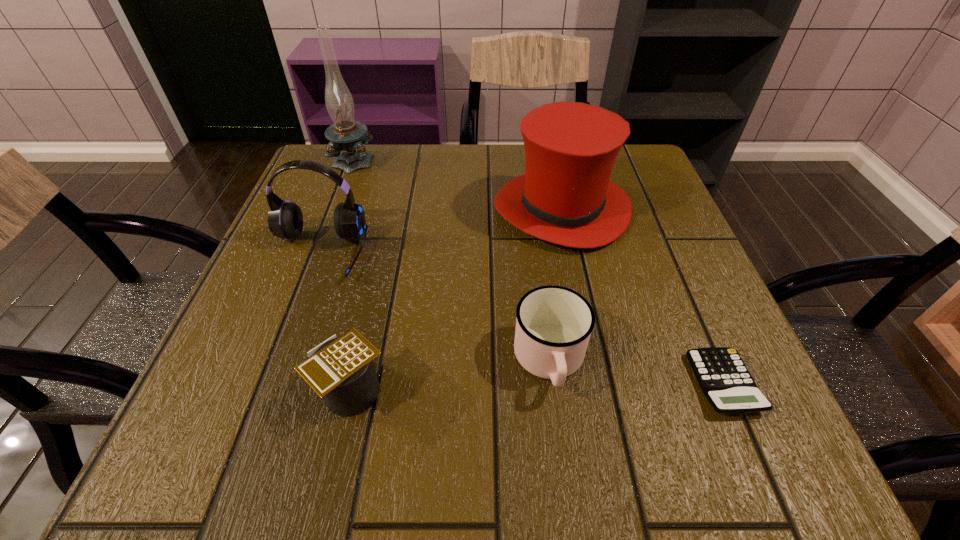
Where is `free region located 0.060m on the side of the mug with the handle`? Image resolution: width=960 pixels, height=540 pixels. free region located 0.060m on the side of the mug with the handle is located at coordinates (561, 444).

Identify the location of free space located on the right of the taller calculator. Image resolution: width=960 pixels, height=540 pixels. (575, 390).

Where is `free point located on the left of the shortest object`? The image size is (960, 540). free point located on the left of the shortest object is located at coordinates (503, 383).

Where is `oil lamp situated at the far edge`? This screenshot has width=960, height=540. oil lamp situated at the far edge is located at coordinates (346, 136).

Where is `hat situated at the far edge`? hat situated at the far edge is located at coordinates (565, 197).

I want to click on oil lamp that is at the left edge, so click(346, 136).

The image size is (960, 540). In order to click on headset present at the left edge in this screenshot , I will do (285, 220).

The height and width of the screenshot is (540, 960). Identify the location of hat that is positioned at the right edge. (565, 197).

Where is `calculator at the right edge`? This screenshot has width=960, height=540. calculator at the right edge is located at coordinates (724, 379).

Identify the location of object that is at the far left corner. (346, 136).